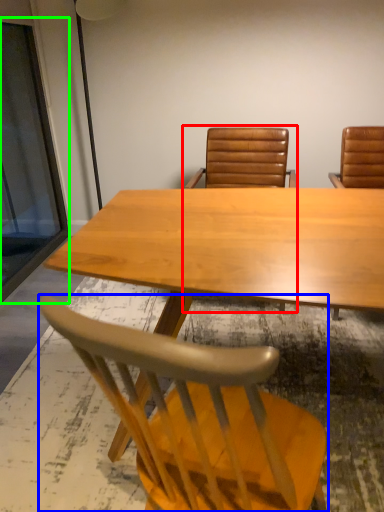
Question: Estimate the real-world distances between objects in this image. Which object is farther from chair (highlighted by a red box), chair (highlighted by a blue box) or glass door (highlighted by a green box)?

Choices:
 (A) chair
 (B) glass door

Answer: (A)